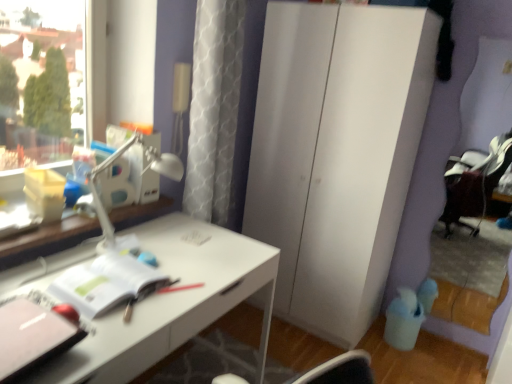
Identify the location of free space to the back side of white matte notebook at center, the 1th notebook when ordered from back to front. (167, 251).